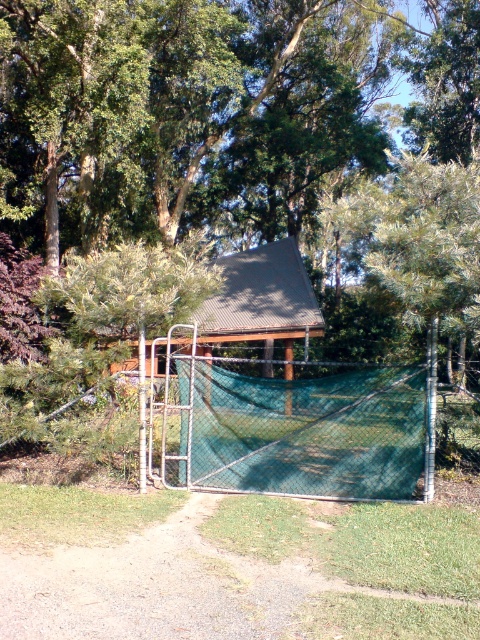
You are planning to place a picnic blanket between the green leafy tree at center and the green corrugated metal hut at center. Based on their widths, which object should you position closer to ensure the blanket fits comfortably?

The green leafy tree at center might be wider than the green corrugated metal hut at center, so positioning the picnic blanket closer to the narrower green corrugated metal hut at center would allow for better space utilization.

You are organizing a tennis tournament and need to set up a court. The tennis court requires a minimum width of 10 meters. Given the green mesh tennis net at center and the green corrugated metal hut at center, which object can you use to determine if the court meets the required width?

The green mesh tennis net at center has a width less than the green corrugated metal hut at center. Therefore, the metal hut can be used as a reference to ensure the court meets the required width since its width is greater than the net.